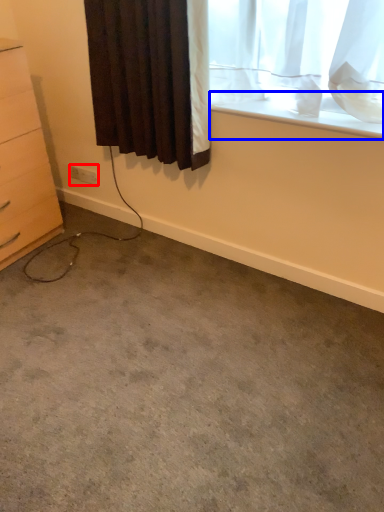
Question: Among these objects, which one is farthest to the camera, electric outlet (highlighted by a red box) or window sill (highlighted by a blue box)?

Choices:
 (A) electric outlet
 (B) window sill

Answer: (A)